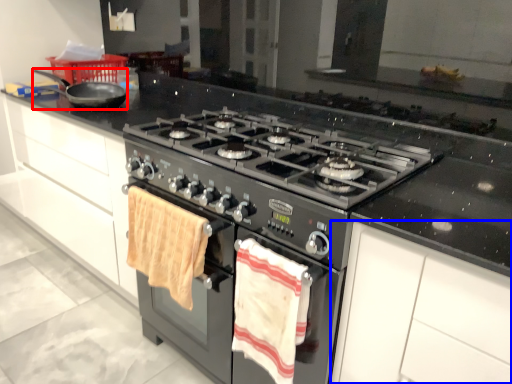
Question: Which point is further to the camera, frying pan (highlighted by a red box) or cabinetry (highlighted by a blue box)?

Choices:
 (A) frying pan
 (B) cabinetry

Answer: (A)